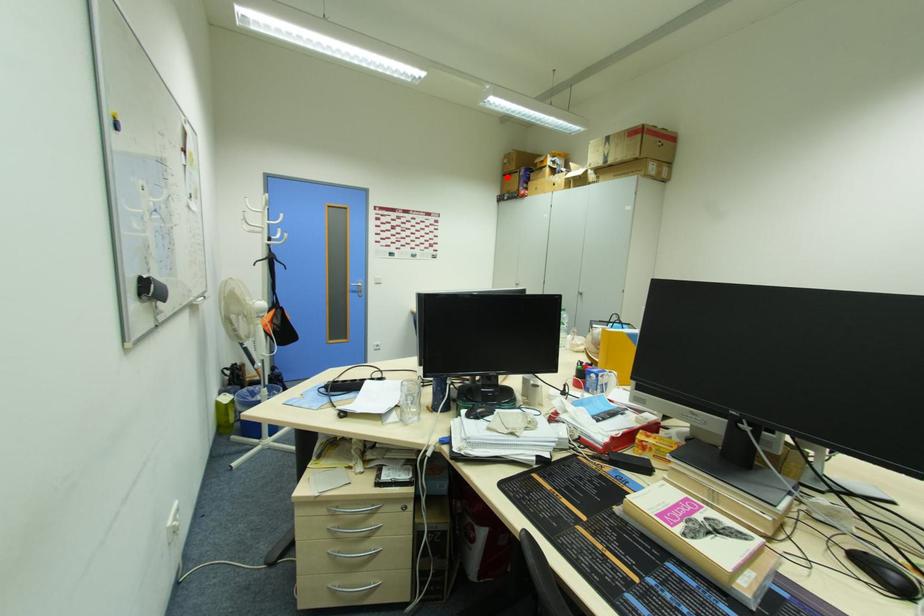
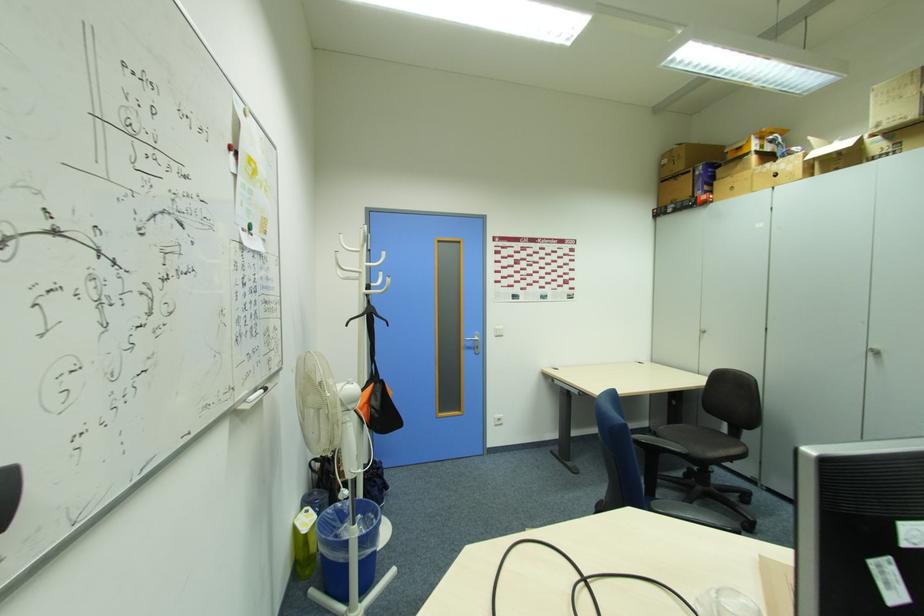
Question: I am providing you with two images of the same scene from different viewpoints. A red point is shown in image1. For the corresponding object point in image2, is it positioned nearer or farther from the camera?

Choices:
 (A) Nearer
 (B) Farther

Answer: (B)